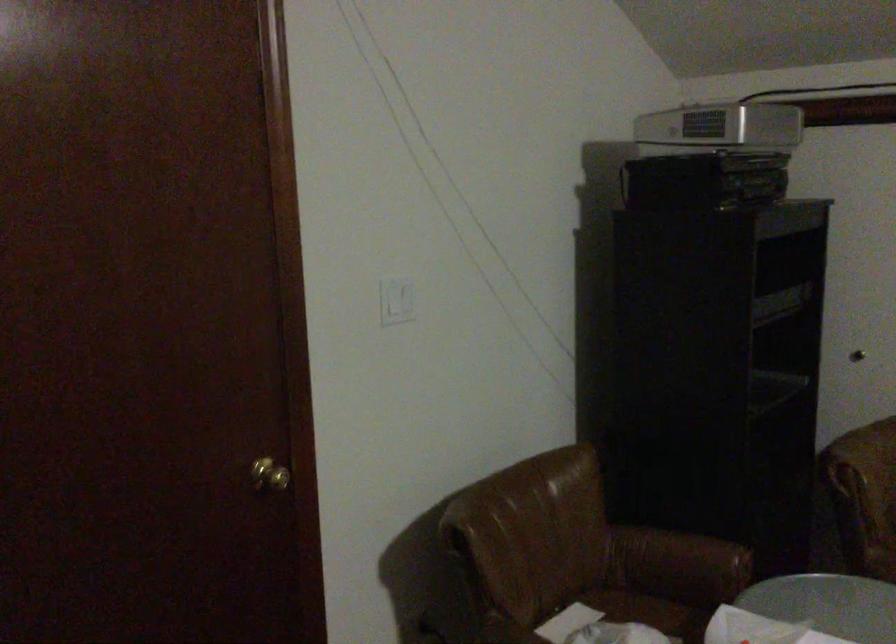
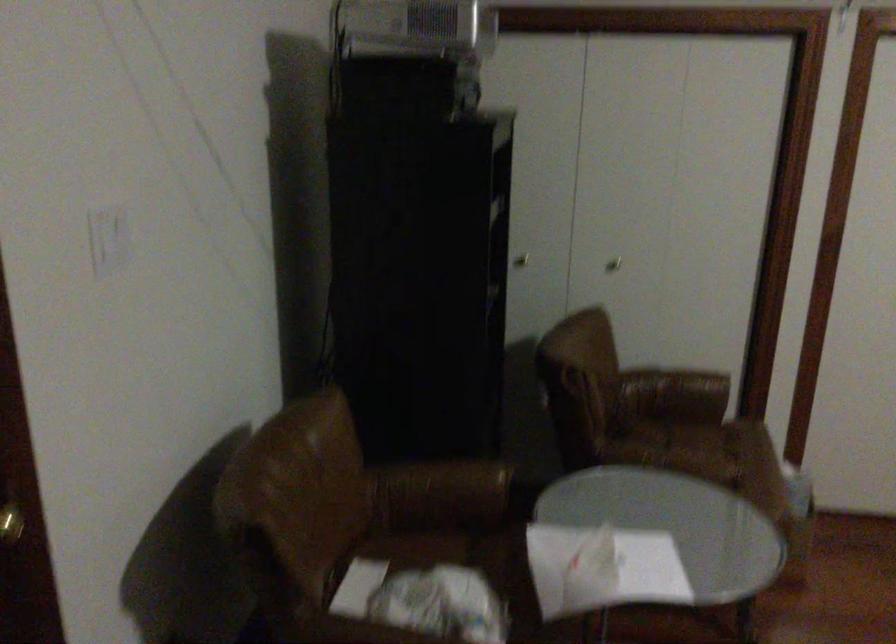
The point at (684,136) is marked in the first image. Where is the corresponding point in the second image?

(412, 26)